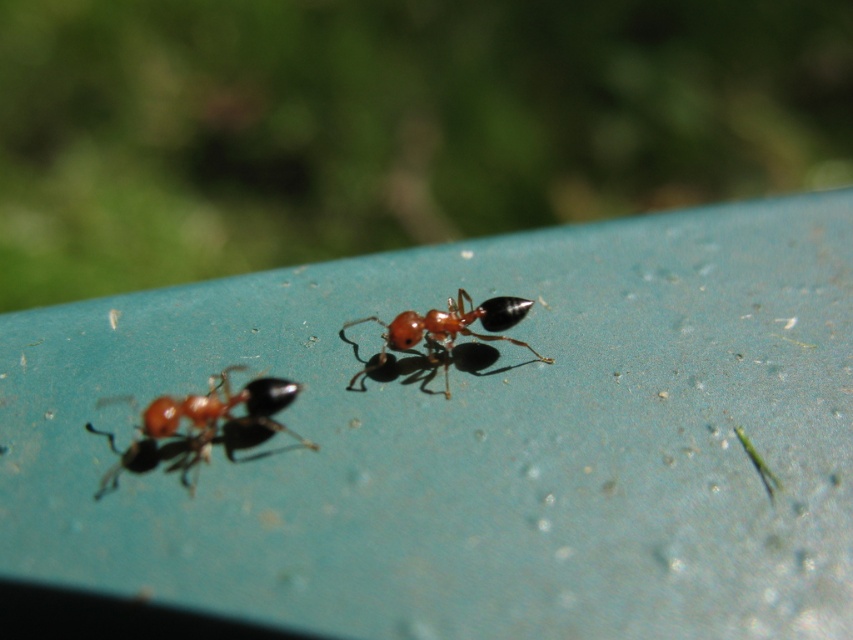
Who is higher up, shiny orange ant at lower left or shiny red ant at center?

shiny red ant at center is above.

Can you confirm if shiny orange ant at lower left is bigger than shiny red ant at center?

Correct, shiny orange ant at lower left is larger in size than shiny red ant at center.

What do you see at coordinates (202, 424) in the screenshot? I see `shiny orange ant at lower left` at bounding box center [202, 424].

This screenshot has height=640, width=853. In order to click on shiny orange ant at lower left in this screenshot , I will do `click(202, 424)`.